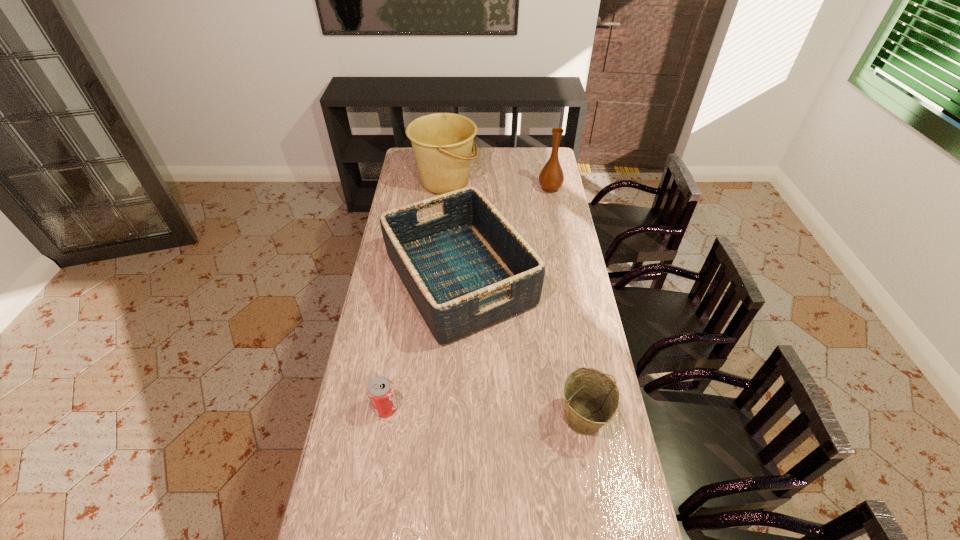
This screenshot has height=540, width=960. Identify the location of vase. (551, 177).

I want to click on bucket, so click(x=442, y=143).

The height and width of the screenshot is (540, 960). What are the coordinates of `wine bucket` in the screenshot? It's located at (591, 398).

You are a GUI agent. You are given a task and a screenshot of the screen. Output one action in this format:
    pyautogui.click(x=<x>, y=<y>)
    Task: Click on the basket
    This screenshot has width=960, height=540.
    Given the screenshot: What is the action you would take?
    pyautogui.click(x=466, y=268)

This screenshot has height=540, width=960. Identify the location of soda can. (381, 393).

Where is `free point located on the front of the vase`? free point located on the front of the vase is located at coordinates (560, 237).

The image size is (960, 540). What are the coordinates of `blank space located 0.370m on the side of the bucket with the handle` in the screenshot? It's located at (548, 182).

In order to click on vacant space situated on the back of the wine bucket in this screenshot , I will do `click(566, 321)`.

You are a GUI agent. You are given a task and a screenshot of the screen. Output one action in this format:
    pyautogui.click(x=<x>, y=<y>)
    Task: Click on the blank space located 0.160m on the front of the basket
    The width and height of the screenshot is (960, 540).
    Given the screenshot: What is the action you would take?
    click(454, 389)

Where is `vacant space located on the back of the soda can`? The image size is (960, 540). vacant space located on the back of the soda can is located at coordinates (396, 348).